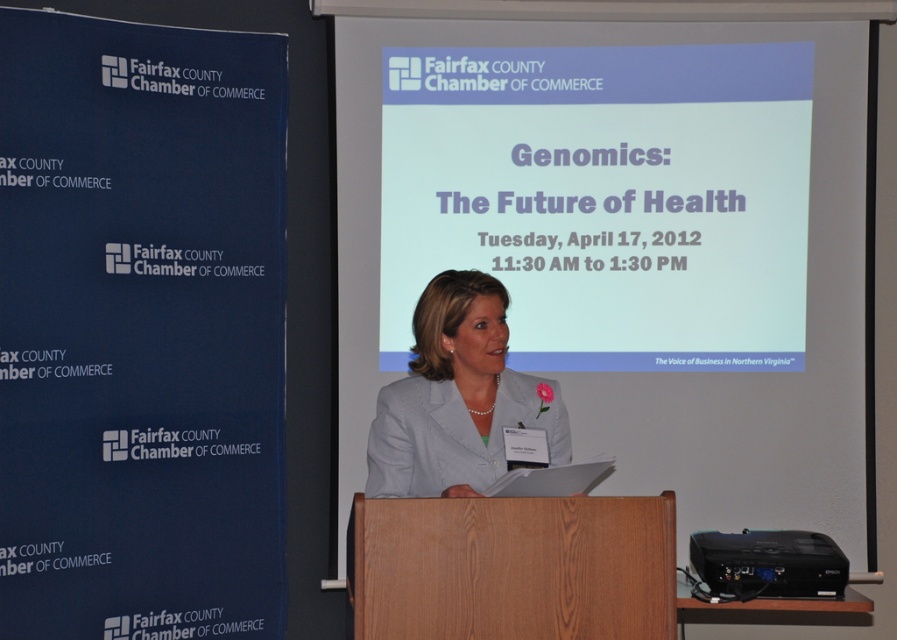
Question: Does white paper at center appear on the right side of white fabric jacket at center?

Choices:
 (A) yes
 (B) no

Answer: (A)

Question: Which point is farther to the camera?

Choices:
 (A) white matte projector screen at center
 (B) white fabric jacket at center
 (C) white paper at center

Answer: (C)

Question: Is white paper at center wider than wooden podium at center?

Choices:
 (A) no
 (B) yes

Answer: (B)

Question: Is white matte projector screen at center above white paper at center?

Choices:
 (A) yes
 (B) no

Answer: (B)

Question: Based on their relative distances, which object is farther from the wooden podium at center?

Choices:
 (A) white paper at center
 (B) white matte projector screen at center
 (C) white fabric jacket at center

Answer: (A)

Question: Estimate the real-world distances between objects in this image. Which object is farther from the wooden podium at center?

Choices:
 (A) white fabric jacket at center
 (B) white matte projector screen at center

Answer: (B)